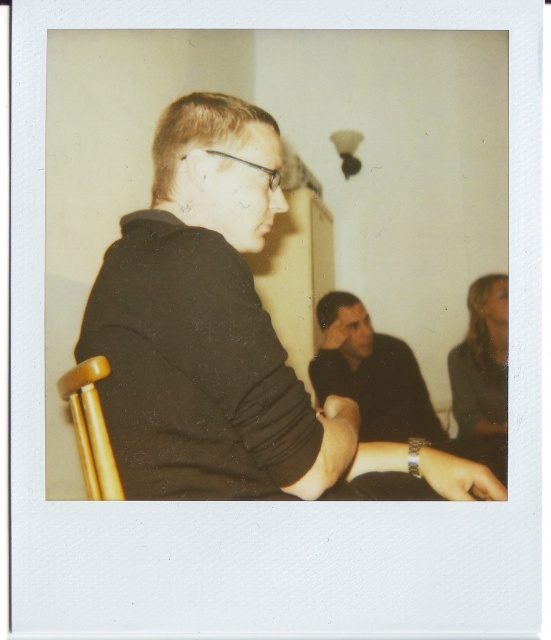
Can you confirm if black matte shirt at center is shorter than matte black hand at center?

In fact, black matte shirt at center may be taller than matte black hand at center.

Is point (176, 426) positioned behind point (339, 330)?

No, (176, 426) is in front of (339, 330).

Identify the location of black matte shirt at center. (213, 330).

Does point (244, 413) come in front of point (73, 417)?

That is True.

Image resolution: width=551 pixels, height=640 pixels. Find the location of `black matte shirt at center`. black matte shirt at center is located at coordinates (213, 330).

Measure the distance between point (170, 321) and camera.

They are 30.12 inches apart.

Where is `black matte shirt at center`? black matte shirt at center is located at coordinates (213, 330).

Is wooden chair at left below matte black hand at center?

Correct, wooden chair at left is located below matte black hand at center.

Which is more to the left, wooden chair at left or matte black hand at center?

wooden chair at left

Does point (88, 372) come closer to viewer compared to point (322, 342)?

Yes, it is.

Locate an element on the screen. wooden chair at left is located at coordinates (90, 428).